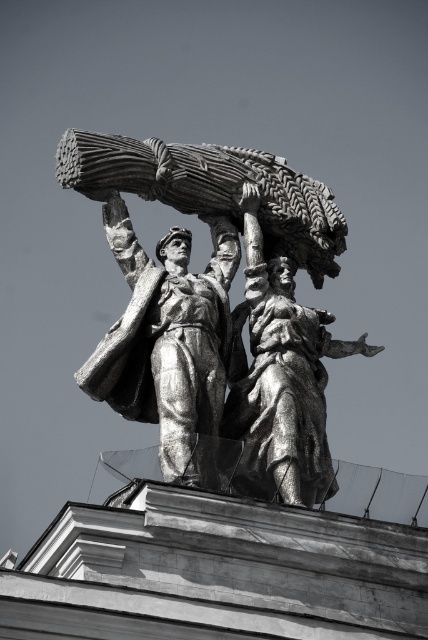
You are an art student analyzing a statue in a museum. You notice two statues at the center of the image. The first is a bronze statue at center, and the second is a shiny silver statue at center. Based on their positions, which statue would appear closer to you?

The bronze statue at center appears closer to you because the shiny silver statue at center is positioned behind it.

You are an art curator planning to move the bronze statue at center and the shiny silver statue at center to a new gallery. The gallery has a space that can only accommodate statues within 5 feet of each other. Can both statues be placed in this space without moving them further apart than the gallery allows?

The distance between the bronze statue at center and the shiny silver statue at center is 5.22 feet, which exceeds the gallery space requirement of 5 feet. Therefore, they cannot be placed in the space without moving them closer.